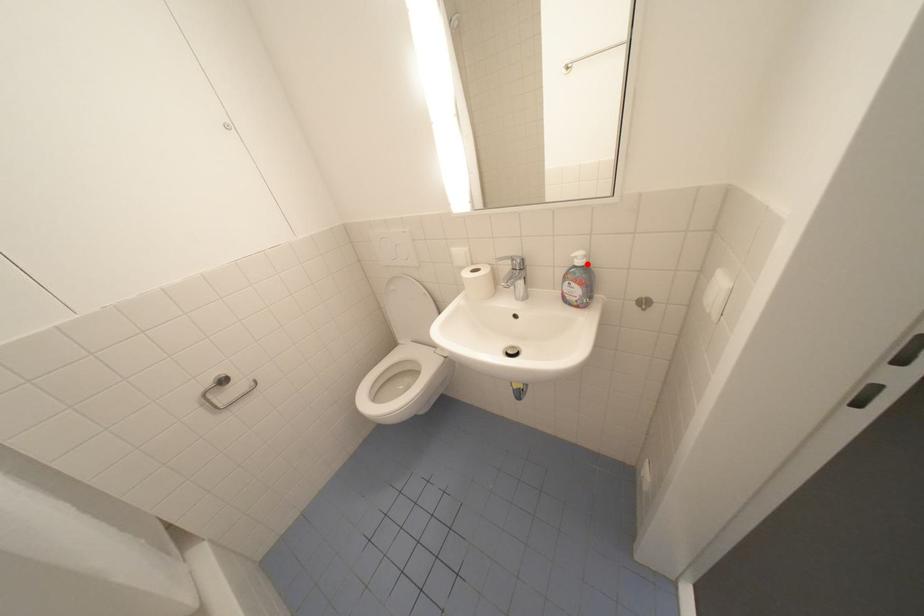
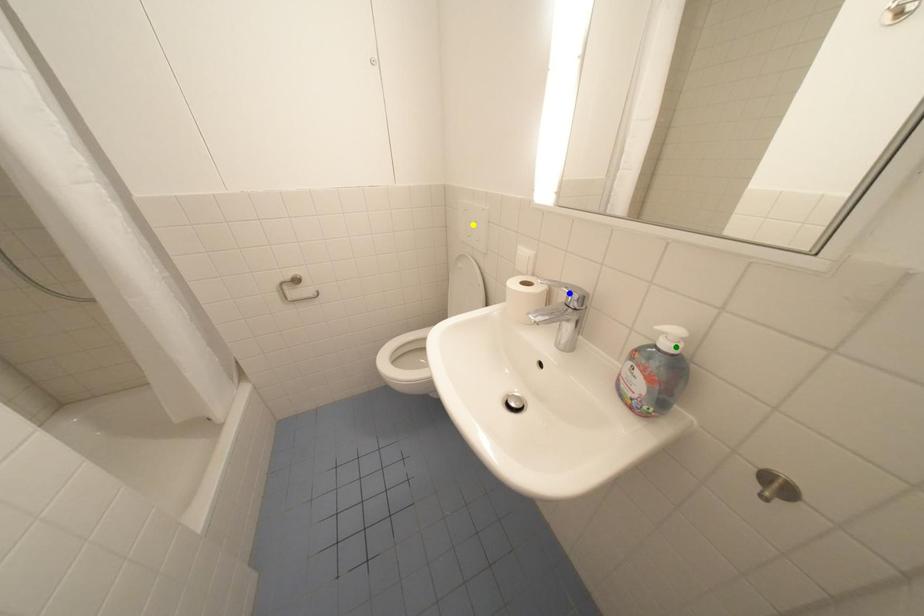
Question: I am providing you with two images of the same scene from different viewpoints. A red point is marked on the first image. You are given multiple points on the second image. Which point in image 2 is actually the same real-world point as the red point in image 1?

Choices:
 (A) green point
 (B) yellow point
 (C) blue point

Answer: (A)